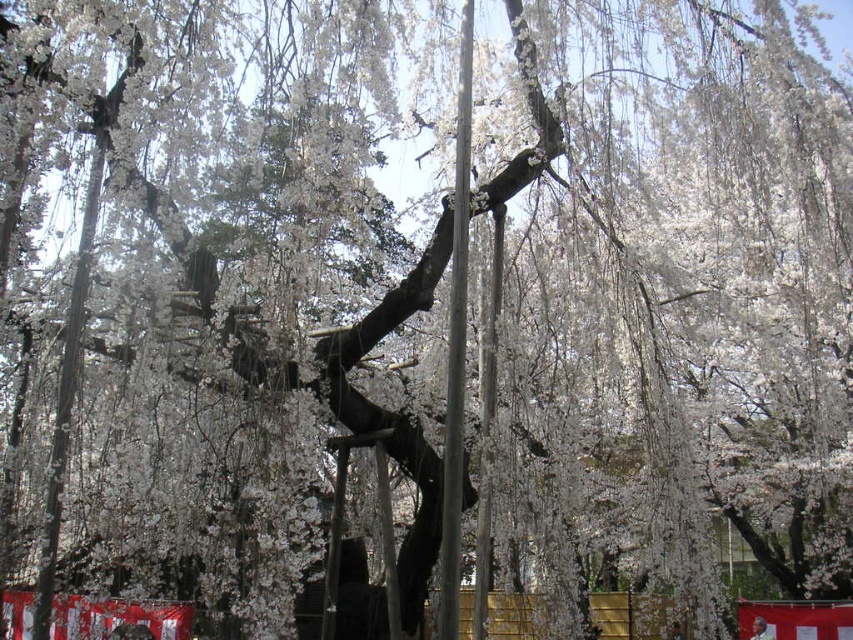
Question: Can you confirm if metallic pole at center is bigger than smooth metallic pole at center?

Choices:
 (A) yes
 (B) no

Answer: (B)

Question: Is metallic pole at center positioned at the back of smooth metallic pole at center?

Choices:
 (A) yes
 (B) no

Answer: (B)

Question: Which point appears closest to the camera in this image?

Choices:
 (A) (457, 291)
 (B) (488, 298)

Answer: (A)

Question: Among these points, which one is nearest to the camera?

Choices:
 (A) (453, 564)
 (B) (480, 353)

Answer: (A)

Question: Can you confirm if metallic pole at center is positioned to the left of smooth metallic pole at center?

Choices:
 (A) no
 (B) yes

Answer: (B)

Question: Among these points, which one is nearest to the camera?

Choices:
 (A) (495, 296)
 (B) (457, 86)

Answer: (B)